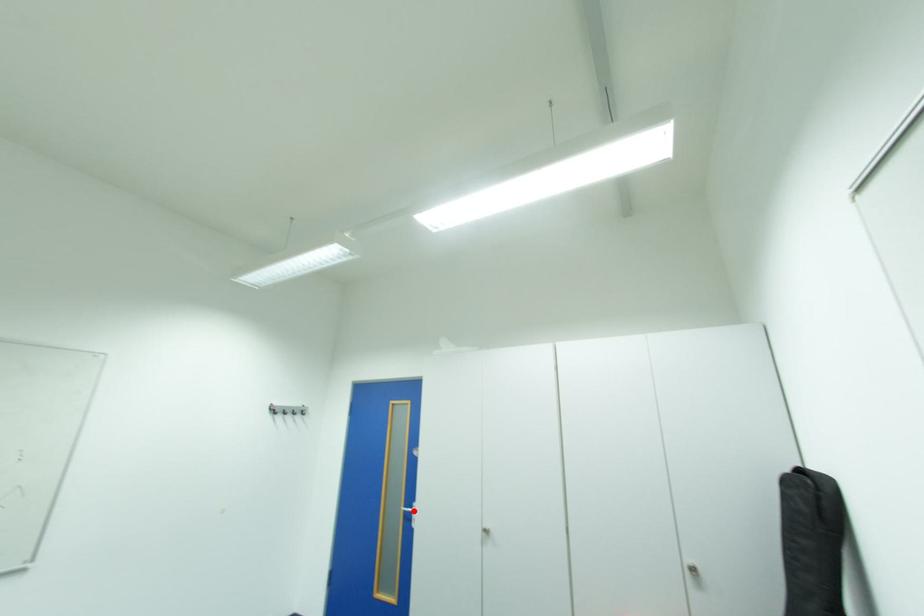
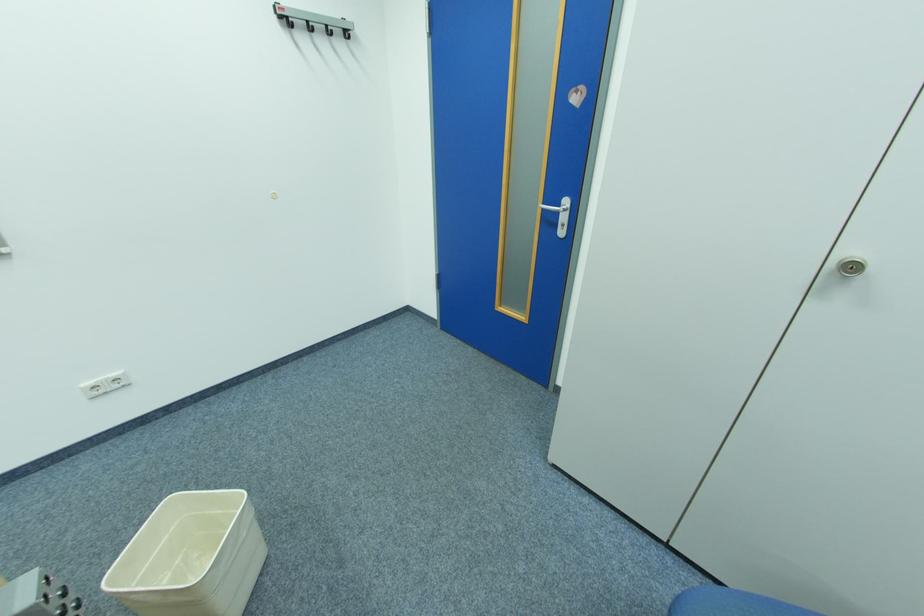
Find the pixel in the second image that matches the highlighted location in the first image.

(552, 209)